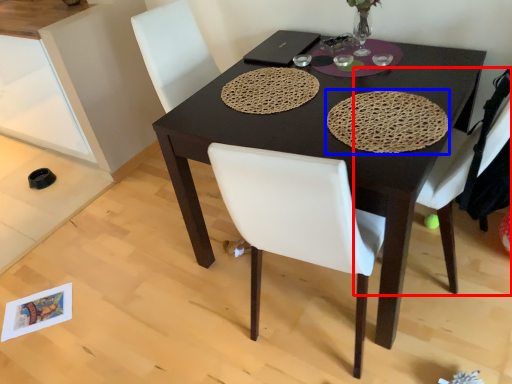
Question: Which object appears farthest to the camera in this image, chair (highlighted by a red box) or mat (highlighted by a blue box)?

Choices:
 (A) chair
 (B) mat

Answer: (B)